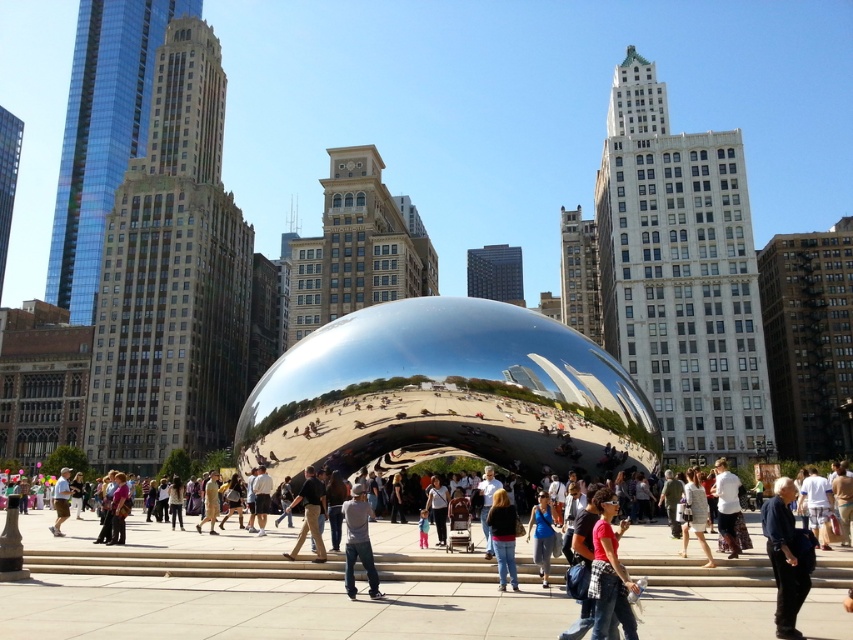
You are a photographer standing at the base of Cloud Gate in Millennium Park. You notice a person wearing a denim jacket at center and dark brown leather pants at center. Which clothing item is positioned lower on their body?

The denim jacket at center is located below the dark brown leather pants at center, so the denim jacket at center is positioned lower on their body.